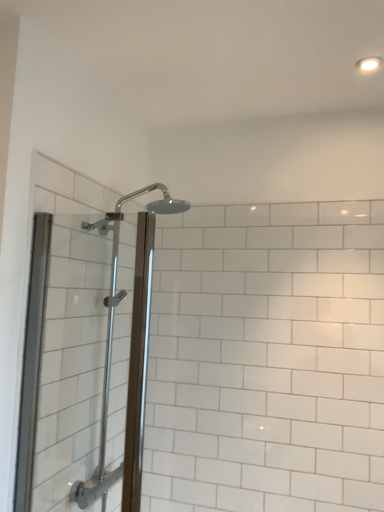
Question: Does polished chrome shower head at upper center have a greater width compared to clear glass shower door at left?

Choices:
 (A) no
 (B) yes

Answer: (B)

Question: Considering the relative sizes of polished chrome shower head at upper center and clear glass shower door at left in the image provided, is polished chrome shower head at upper center taller than clear glass shower door at left?

Choices:
 (A) no
 (B) yes

Answer: (B)

Question: Can you confirm if polished chrome shower head at upper center is thinner than clear glass shower door at left?

Choices:
 (A) yes
 (B) no

Answer: (B)

Question: Is polished chrome shower head at upper center completely or partially outside of clear glass shower door at left?

Choices:
 (A) yes
 (B) no

Answer: (A)

Question: Is polished chrome shower head at upper center oriented towards clear glass shower door at left?

Choices:
 (A) yes
 (B) no

Answer: (B)

Question: Relative to polished chrome shower head at upper center, is clear glass shower door at left in front or behind?

Choices:
 (A) behind
 (B) front

Answer: (B)

Question: Is clear glass shower door at left bigger or smaller than polished chrome shower head at upper center?

Choices:
 (A) small
 (B) big

Answer: (A)

Question: From a real-world perspective, is clear glass shower door at left above or below polished chrome shower head at upper center?

Choices:
 (A) above
 (B) below

Answer: (A)

Question: Which is correct: clear glass shower door at left is inside polished chrome shower head at upper center, or outside of it?

Choices:
 (A) outside
 (B) inside

Answer: (A)

Question: Considering the positions of polished chrome shower head at upper center and clear glass shower door at left in the image, is polished chrome shower head at upper center wider or thinner than clear glass shower door at left?

Choices:
 (A) thin
 (B) wide

Answer: (B)

Question: Considering the positions of polished chrome shower head at upper center and clear glass shower door at left in the image, is polished chrome shower head at upper center bigger or smaller than clear glass shower door at left?

Choices:
 (A) small
 (B) big

Answer: (B)

Question: From a real-world perspective, is polished chrome shower head at upper center physically located above or below clear glass shower door at left?

Choices:
 (A) below
 (B) above

Answer: (A)

Question: From their relative heights in the image, would you say polished chrome shower head at upper center is taller or shorter than clear glass shower door at left?

Choices:
 (A) short
 (B) tall

Answer: (B)

Question: Considering the positions of polished chrome shower head at upper center and white glossy light fixture at upper right in the image, is polished chrome shower head at upper center taller or shorter than white glossy light fixture at upper right?

Choices:
 (A) tall
 (B) short

Answer: (A)

Question: Is polished chrome shower head at upper center inside the boundaries of white glossy light fixture at upper right, or outside?

Choices:
 (A) inside
 (B) outside

Answer: (B)